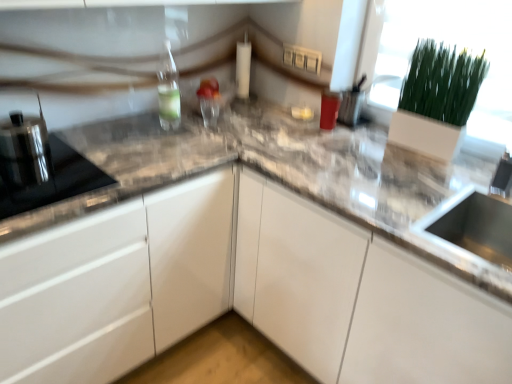
Question: Is clear glass bottle at upper left at the left side of matte plastic container at upper right, the first appliance in the back-to-front sequence?

Choices:
 (A) yes
 (B) no

Answer: (A)

Question: Could matte plastic container at upper right, the first appliance in the back-to-front sequence, be considered to be inside clear glass bottle at upper left?

Choices:
 (A) yes
 (B) no

Answer: (B)

Question: Is clear glass bottle at upper left closer to the viewer compared to matte plastic container at upper right, the 1th appliance when ordered from right to left?

Choices:
 (A) no
 (B) yes

Answer: (B)

Question: From a real-world perspective, is clear glass bottle at upper left on matte plastic container at upper right, the 1th appliance when ordered from right to left?

Choices:
 (A) yes
 (B) no

Answer: (A)

Question: Does clear glass bottle at upper left have a greater width compared to matte plastic container at upper right, which ranks as the third appliance in front-to-back order?

Choices:
 (A) yes
 (B) no

Answer: (A)

Question: Can you confirm if clear glass bottle at upper left is taller than matte plastic container at upper right, the first appliance in the back-to-front sequence?

Choices:
 (A) no
 (B) yes

Answer: (B)

Question: Is white glossy cabinet at center not inside satin black kettle at left, which is the 2th appliance from back to front?

Choices:
 (A) no
 (B) yes

Answer: (B)

Question: From the image's perspective, is white glossy cabinet at center located above satin black kettle at left, marked as the first appliance in a left-to-right arrangement?

Choices:
 (A) no
 (B) yes

Answer: (A)

Question: Is satin black kettle at left, which is the 2th appliance from back to front, inside white glossy cabinet at center?

Choices:
 (A) yes
 (B) no

Answer: (B)

Question: Does white glossy cabinet at center have a greater height compared to satin black kettle at left, marked as the first appliance in a left-to-right arrangement?

Choices:
 (A) no
 (B) yes

Answer: (B)

Question: Is white glossy cabinet at center thinner than satin black kettle at left, placed as the 2th appliance when sorted from front to back?

Choices:
 (A) yes
 (B) no

Answer: (B)

Question: Is white glossy cabinet at center next to satin black kettle at left, which is the 2th appliance from back to front?

Choices:
 (A) yes
 (B) no

Answer: (B)

Question: Is white matte glass door at upper right oriented away from matte plastic container at upper right, placed as the third appliance when sorted from left to right?

Choices:
 (A) no
 (B) yes

Answer: (A)